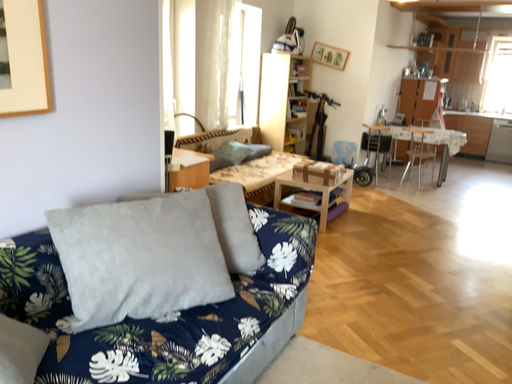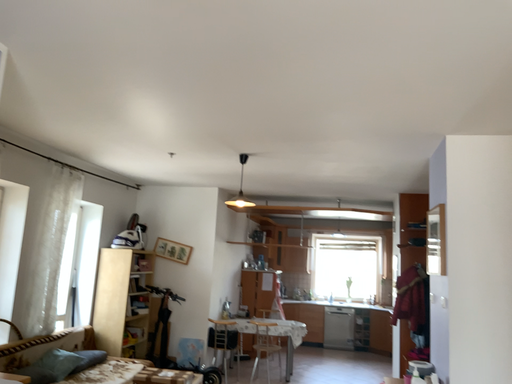
Question: How did the camera likely rotate when shooting the video?

Choices:
 (A) rotated downward
 (B) rotated upward

Answer: (B)